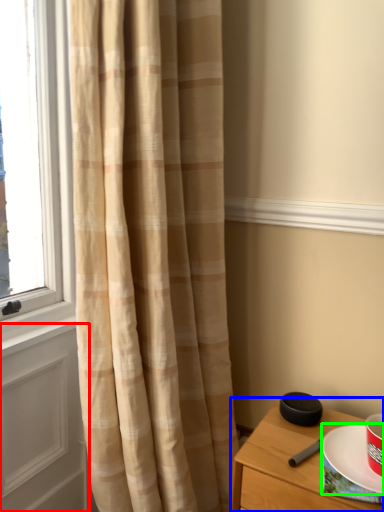
Question: Which object is the farthest from screen door (highlighted by a red box)? Choose among these: nightstand (highlighted by a blue box) or paper plate (highlighted by a green box).

Choices:
 (A) nightstand
 (B) paper plate

Answer: (B)